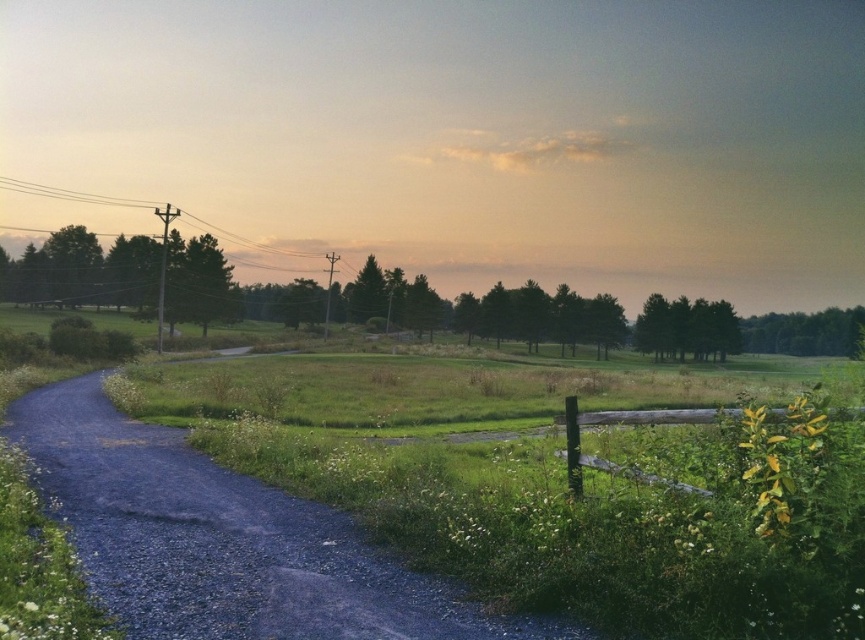
Question: Which is farther from the green leafy tree at left?

Choices:
 (A) gravelly dirt path at center
 (B) white plastic power line at upper left

Answer: (B)

Question: Is green leafy tree at left to the right of green matte tree at upper left from the viewer's perspective?

Choices:
 (A) no
 (B) yes

Answer: (A)

Question: Among these objects, which one is nearest to the camera?

Choices:
 (A) green leafy tree at left
 (B) green leafy trees at right
 (C) white plastic power line at upper left
 (D) green matte tree at center

Answer: (A)

Question: Can you confirm if green leafy trees at right is positioned below green matte tree at center?

Choices:
 (A) no
 (B) yes

Answer: (B)

Question: Which object appears farthest from the camera in this image?

Choices:
 (A) green leafy tree at left
 (B) green matte tree at upper left
 (C) green leafy trees at right
 (D) green matte tree at center

Answer: (C)

Question: Where is green leafy tree at left located in relation to green matte tree at upper left in the image?

Choices:
 (A) below
 (B) above

Answer: (B)